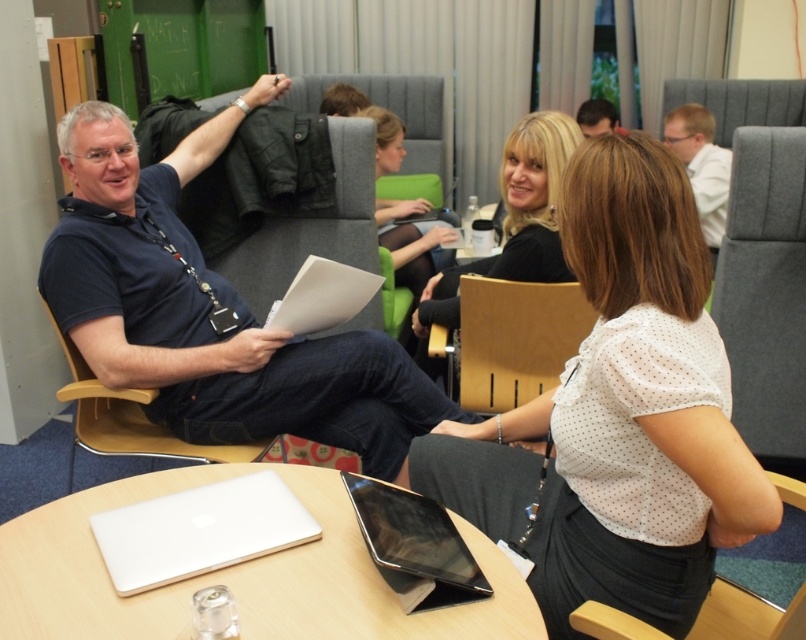
Is dark blue shirt at left thinner than wooden at left?

No, dark blue shirt at left is not thinner than wooden at left.

Between dark blue shirt at left and wooden at left, which one has less height?

wooden at left

Does point (183, 412) come behind point (161, 451)?

No.

Identify the location of dark blue shirt at left. (210, 310).

Which is in front, point (264, 484) or point (189, 449)?

Point (264, 484) is more forward.

Who is positioned more to the left, white matte laptop at lower center or wooden at left?

From the viewer's perspective, wooden at left appears more on the left side.

Is point (277, 481) positioned behind point (134, 392)?

No, (277, 481) is in front of (134, 392).

I want to click on white matte laptop at lower center, so click(198, 531).

Does point (231, 563) come in front of point (424, 355)?

Yes.

You are a GUI agent. You are given a task and a screenshot of the screen. Output one action in this format:
    pyautogui.click(x=<x>, y=<y>)
    Task: Click on the white matte laptop at lower center
    This screenshot has width=806, height=640.
    Given the screenshot: What is the action you would take?
    pyautogui.click(x=198, y=531)